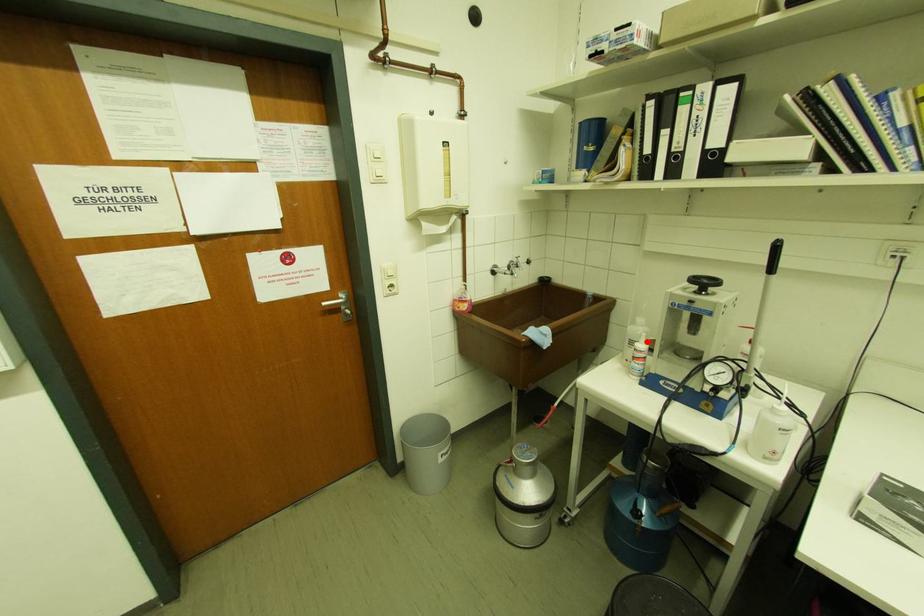
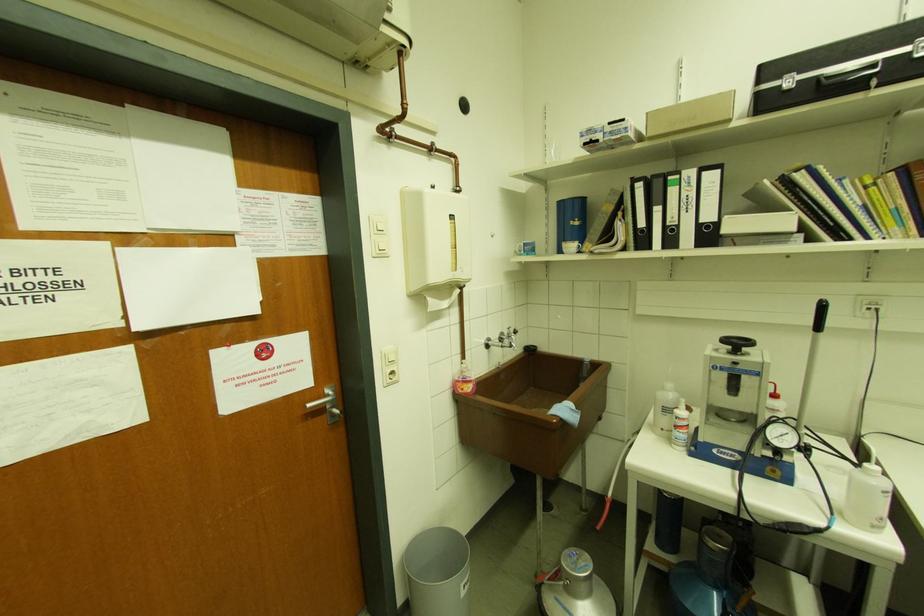
Find the pixel in the second image that matches the highlighted location in the first image.

(687, 408)